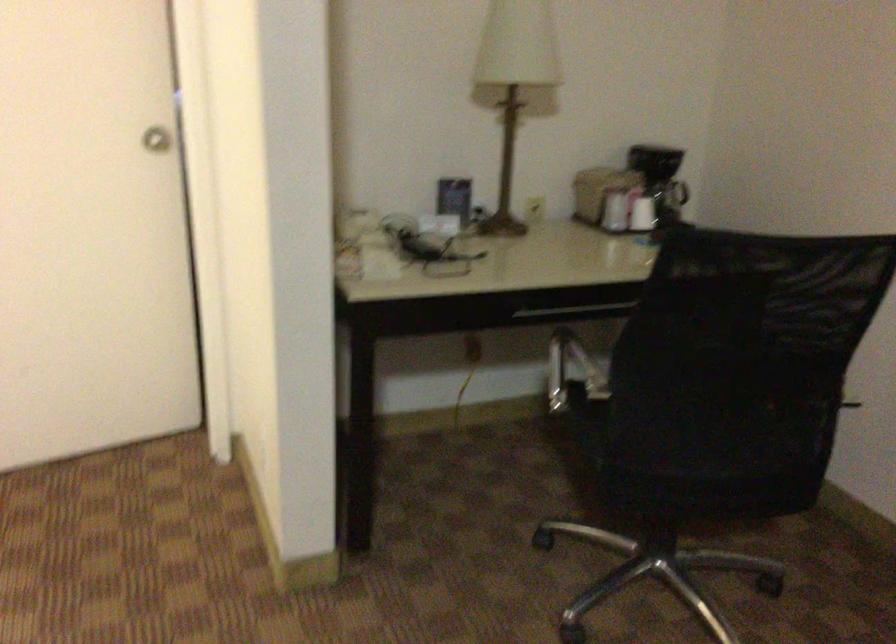
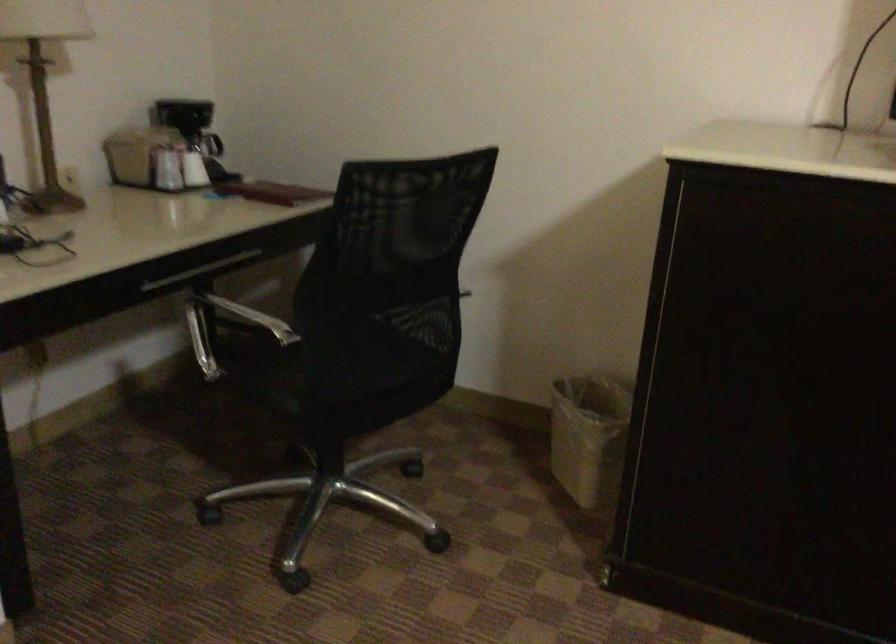
Find the pixel in the second image that matches pixel 608 211 in the first image.

(165, 169)